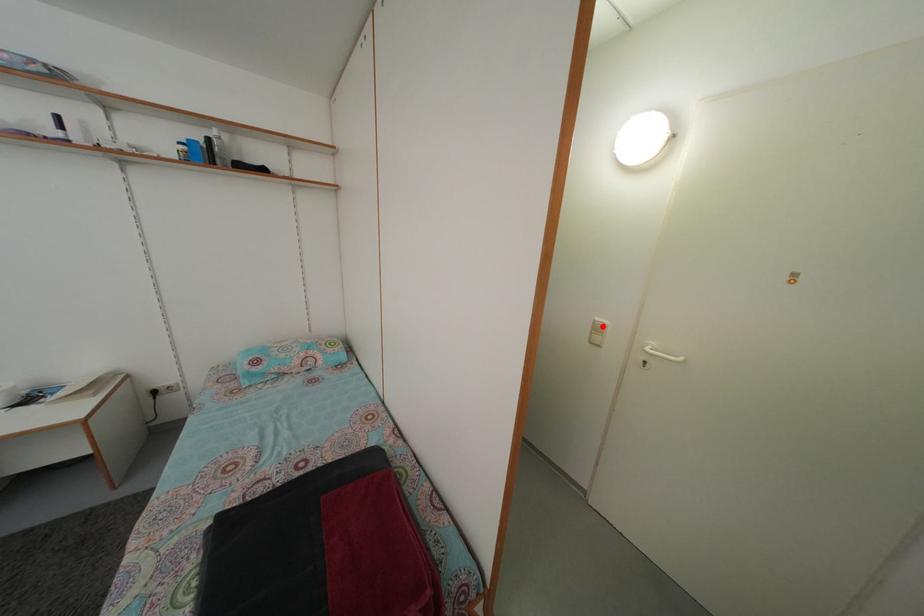
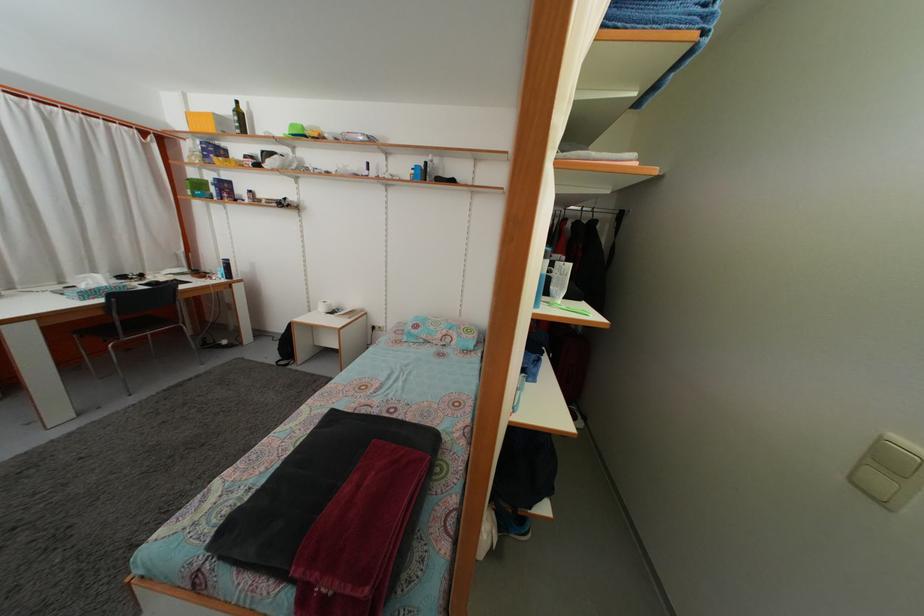
Where in the second image is the point corresponding to the highlighted location from the first image?

(903, 445)